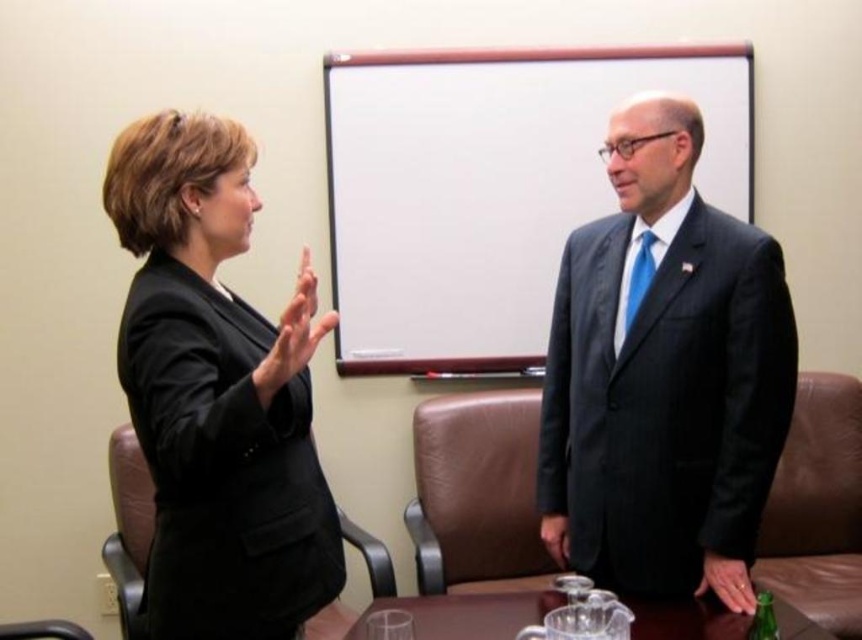
You are a photographer in a conference room. You need to take a photo of the dark blue suit at right and the black matte suit at left. Based on their positions, which suit will appear larger in the photo?

The dark blue suit at right is located above the black matte suit at left, so it will appear larger in the photo due to its higher position in the frame.

You are setting up for a presentation and need to know which object is larger between the white matte projection screen at upper center and the clear glass table at center. Which one is bigger?

The white matte projection screen at upper center is bigger than the clear glass table at center according to the description.